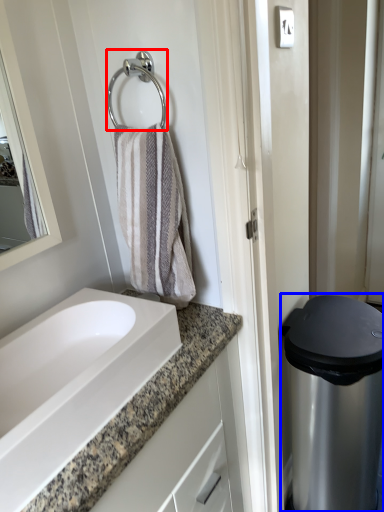
Question: Which object is closer to the camera taking this photo, shower (highlighted by a red box) or appliance (highlighted by a blue box)?

Choices:
 (A) shower
 (B) appliance

Answer: (A)